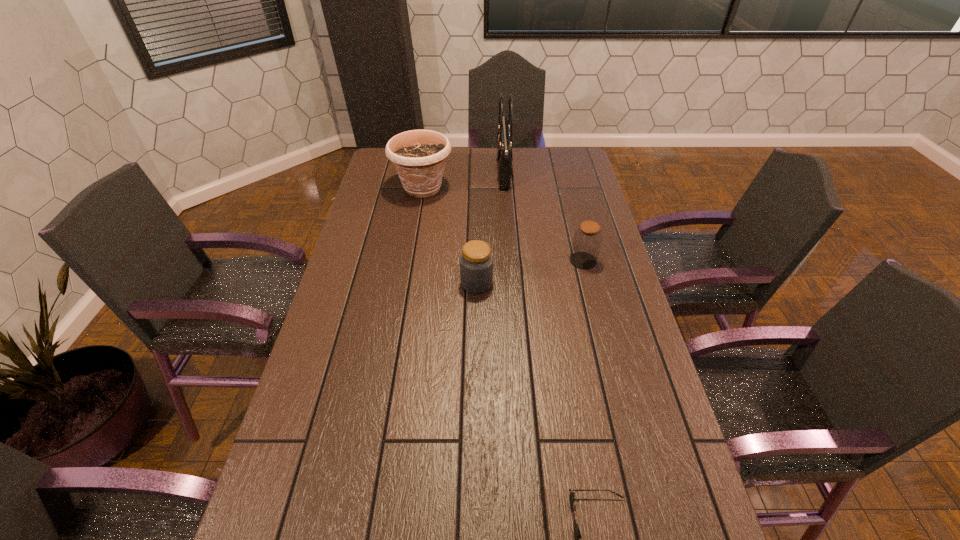
The height and width of the screenshot is (540, 960). I want to click on the tallest object, so click(504, 134).

This screenshot has height=540, width=960. I want to click on handbag, so click(x=504, y=134).

You are a GUI agent. You are given a task and a screenshot of the screen. Output one action in this format:
    pyautogui.click(x=<x>, y=<y>)
    Task: Click on the leftmost object
    The image size is (960, 540).
    Given the screenshot: What is the action you would take?
    tap(419, 156)

The width and height of the screenshot is (960, 540). I want to click on flowerpot, so coord(419,156).

This screenshot has width=960, height=540. I want to click on the nearer jar, so click(x=476, y=261).

Identify the location of the left jar. This screenshot has height=540, width=960. (476, 261).

Where is `the farther jar`? The height and width of the screenshot is (540, 960). the farther jar is located at coordinates (587, 240).

Identify the location of the third farthest object. (587, 240).

You are a GUI agent. You are given a task and a screenshot of the screen. Output one action in this format:
    pyautogui.click(x=<x>, y=<y>)
    Task: Click on the free space located 0.220m with an open clasp on the front of the third object from left to right
    
    Given the screenshot: What is the action you would take?
    [444, 172]

You are a GUI agent. You are given a task and a screenshot of the screen. Output one action in this format:
    pyautogui.click(x=<x>, y=<y>)
    Task: Click on the free space located 0.240m with an open clasp on the front of the third object from left to right
    
    Given the screenshot: What is the action you would take?
    pyautogui.click(x=440, y=172)